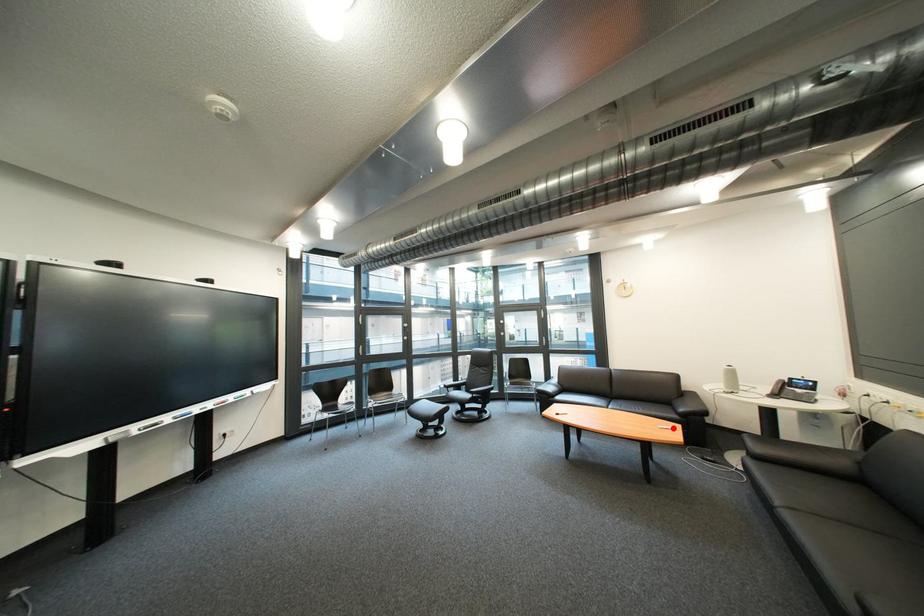
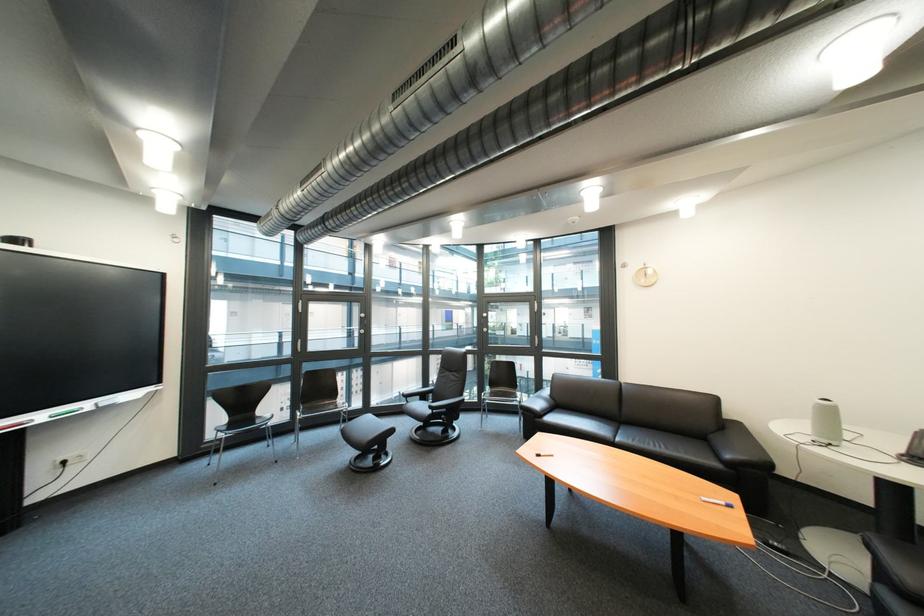
Question: A red point is marked in image1. In image2, is the corresponding 3D point closer to the camera or farther? Reply with the corresponding letter.

Choices:
 (A) The corresponding 3D point is closer.
 (B) The corresponding 3D point is farther.

Answer: (B)